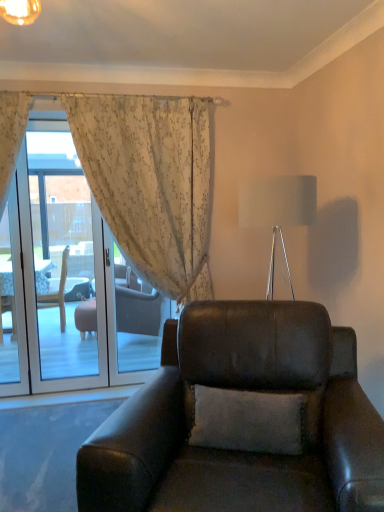
Question: Is transparent glass screen door at left bigger or smaller than matte black leather armchair at center?

Choices:
 (A) small
 (B) big

Answer: (A)

Question: Is transparent glass screen door at left in front of or behind matte black leather armchair at center in the image?

Choices:
 (A) front
 (B) behind

Answer: (B)

Question: Based on their relative distances, which object is farther from the floral sheer curtain at upper left?

Choices:
 (A) white fabric lampshade at upper center
 (B) matte black leather armchair at center
 (C) transparent glass screen door at left

Answer: (C)

Question: Based on their relative distances, which object is farther from the floral sheer curtain at upper left?

Choices:
 (A) white fabric lampshade at upper center
 (B) transparent glass screen door at left
 (C) matte black leather armchair at center

Answer: (B)